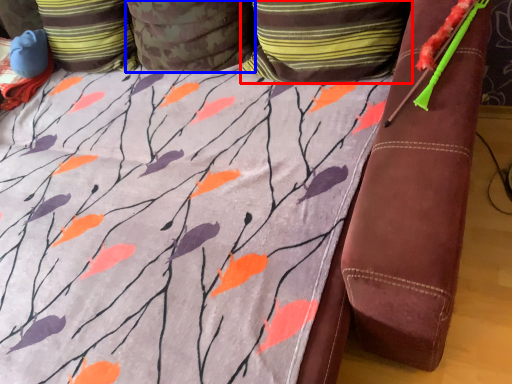
Question: Which of the following is the farthest to the observer, pillow (highlighted by a red box) or pillow (highlighted by a blue box)?

Choices:
 (A) pillow
 (B) pillow

Answer: (B)